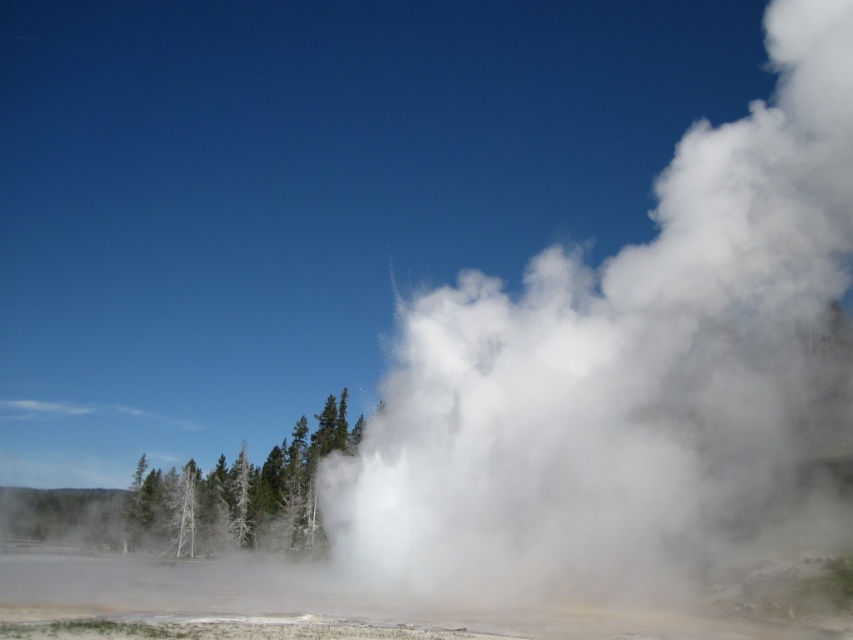
Does white vapor at center appear on the left side of green matte tree at center?

Incorrect, white vapor at center is not on the left side of green matte tree at center.

Is point (491, 305) positioned behind point (160, 499)?

No, it is not.

Which is behind, point (808, 112) or point (349, 445)?

Point (349, 445)

You are a GUI agent. You are given a task and a screenshot of the screen. Output one action in this format:
    pyautogui.click(x=<x>, y=<y>)
    Task: Click on the white vapor at center
    The width and height of the screenshot is (853, 640).
    Given the screenshot: What is the action you would take?
    pyautogui.click(x=624, y=372)